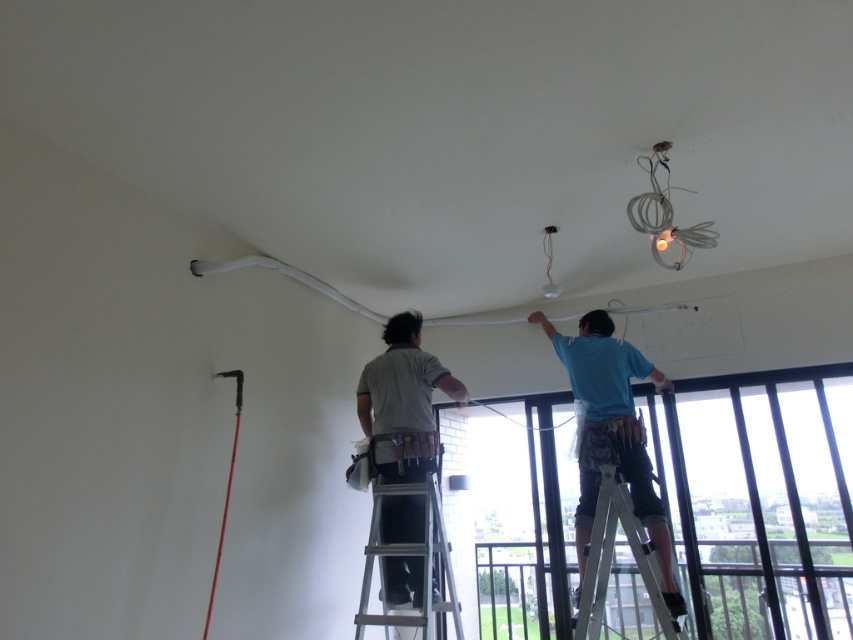
Question: Is blue fabric shirt at upper center thinner than white metallic ladder at lower right?

Choices:
 (A) yes
 (B) no

Answer: (B)

Question: Is gray fabric shirt at center to the right of white metallic ladder at lower right from the viewer's perspective?

Choices:
 (A) yes
 (B) no

Answer: (B)

Question: Which is nearer to the silver metallic ladder at center?

Choices:
 (A) gray fabric shirt at center
 (B) white metallic ladder at lower right

Answer: (A)

Question: Can you confirm if gray fabric shirt at center is bigger than white metallic ladder at lower right?

Choices:
 (A) yes
 (B) no

Answer: (A)

Question: Which point is farther to the camera?

Choices:
 (A) (666, 548)
 (B) (601, 582)

Answer: (A)

Question: Estimate the real-world distances between objects in this image. Which object is farther from the silver metallic ladder at center?

Choices:
 (A) white metallic ladder at lower right
 (B) gray fabric shirt at center
 (C) blue fabric shirt at upper center

Answer: (C)